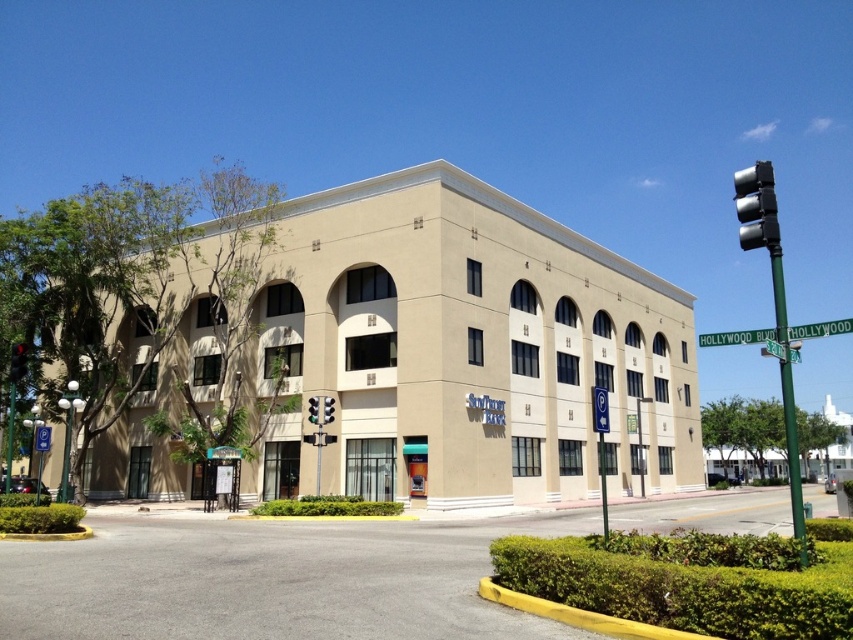
Question: Which object is positioned closest to the black plastic traffic light at left?

Choices:
 (A) green glass traffic light at center
 (B) green wood street sign at upper right
 (C) green metallic pole at right
 (D) black plastic traffic light at upper right

Answer: (A)

Question: Can you confirm if green metallic pole at right is positioned to the left of black plastic traffic light at upper right?

Choices:
 (A) no
 (B) yes

Answer: (A)

Question: Considering the real-world distances, which object is closest to the green glass traffic light at center?

Choices:
 (A) metallic traffic light at center
 (B) black plastic traffic light at left

Answer: (A)

Question: Considering the real-world distances, which object is farthest from the green glass traffic light at center?

Choices:
 (A) black plastic traffic light at upper right
 (B) green metallic pole at right
 (C) metallic traffic light at center
 (D) black plastic traffic light at left

Answer: (B)

Question: Does black plastic traffic light at upper right have a greater width compared to green glass traffic light at center?

Choices:
 (A) yes
 (B) no

Answer: (A)

Question: Is black plastic traffic light at upper right below black plastic traffic light at left?

Choices:
 (A) yes
 (B) no

Answer: (B)